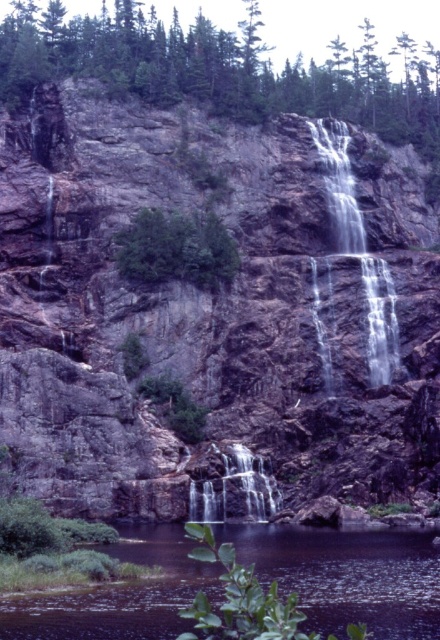
Between brown rough rock face at center and translucent white water at center, which one is positioned lower?

translucent white water at center is lower down.

Who is more forward, (103, 339) or (244, 456)?

Point (244, 456) is more forward.

At what (x,y) coordinates should I click in order to perform the action: click on brown rough rock face at center. Please return your answer as a coordinate pair (x, y). The image size is (440, 640). Looking at the image, I should click on (205, 308).

Does brown rough rock face at center have a lesser width compared to green leafy tree at center?

In fact, brown rough rock face at center might be wider than green leafy tree at center.

Which is more to the right, brown rough rock face at center or green leafy tree at center?

brown rough rock face at center

Who is more distant from viewer, (341, 369) or (212, 243)?

Positioned behind is point (212, 243).

Find the location of `brown rough rock face at center`. brown rough rock face at center is located at coordinates (205, 308).

Which is behind, point (381, 300) or point (216, 243)?

The point (381, 300) is behind.

Consider the image. Which of these two, clear water at center or green leafy tree at center, stands taller?

clear water at center is taller.

Which is in front, point (351, 182) or point (235, 269)?

Positioned in front is point (235, 269).

Identify the location of clear water at center. (359, 252).